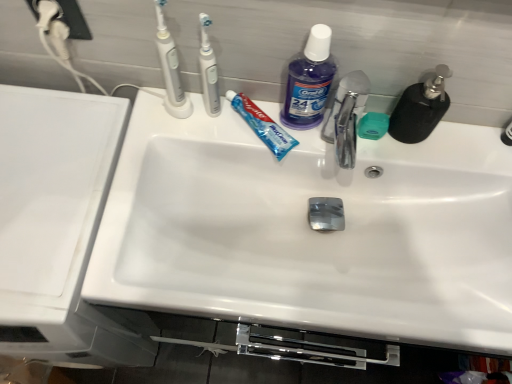
Question: Is point (185, 109) closer or farther from the camera than point (423, 183)?

Choices:
 (A) closer
 (B) farther

Answer: (A)

Question: In terms of size, does white plastic toothbrush at upper left, placed as the 1th toothbrush when sorted from left to right, appear bigger or smaller than white glossy sink at center?

Choices:
 (A) big
 (B) small

Answer: (B)

Question: Estimate the real-world distances between objects in this image. Which object is farther from the white glossy sink at left?

Choices:
 (A) white glossy sink at center
 (B) purple translucent liquid at upper center
 (C) white plastic toothbrush at upper center, which ranks as the 2th toothbrush in left-to-right order
 (D) black matte soap dispenser at upper right
 (E) white plastic toothbrush at upper left, which appears as the 2th toothbrush when viewed from the right

Answer: (D)

Question: Which object is positioned closest to the green matte soap at center?

Choices:
 (A) blue glossy toothpaste at center
 (B) white glossy sink at center
 (C) black matte soap dispenser at upper right
 (D) purple translucent liquid at upper center
 (E) white plastic toothbrush at upper center, which ranks as the 1th toothbrush in right-to-left order

Answer: (C)